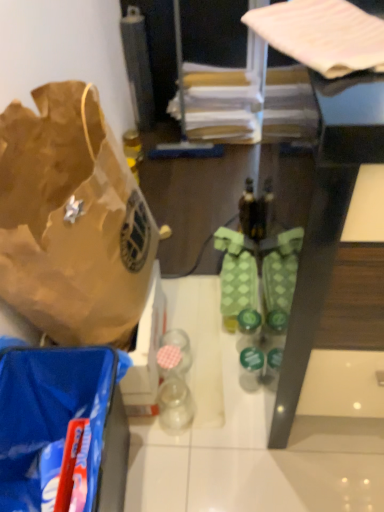
Describe the element at coordinates (72, 220) in the screenshot. I see `brown paper bag at left` at that location.

The width and height of the screenshot is (384, 512). Find the location of `blue plastic bag at lower left`. blue plastic bag at lower left is located at coordinates [x=61, y=420].

In order to face pink fabric at upper right, which is counted as the first wrapping paper, starting from the bottom, should I rotate leftwards or rightwards?

You should look right and rotate roughly 18.516 degrees.

How much space does matte brown wrapping paper at upper center, marked as the 2th wrapping paper in a bottom-to-top arrangement, occupy horizontally?

The width of matte brown wrapping paper at upper center, marked as the 2th wrapping paper in a bottom-to-top arrangement, is 11.35 inches.

This screenshot has height=512, width=384. In order to click on brown paper bag at left in this screenshot , I will do `click(72, 220)`.

Looking at this image, is pink fabric at upper right, arranged as the 2th wrapping paper when viewed from the back, not inside brown paper bag at left?

pink fabric at upper right, arranged as the 2th wrapping paper when viewed from the back, is positioned outside brown paper bag at left.

From a real-world perspective, which object rests below the other?

In real-world perspective, brown paper bag at left is lower.

In order to click on wrapping paper that is above the brown paper bag at left (from a real-world perspective) in this screenshot , I will do `click(322, 35)`.

Can we say matte brown wrapping paper at upper center, which is the 1th wrapping paper in top-to-bottom order, lies outside green matte bottle at center?

Yes.

Can you confirm if matte brown wrapping paper at upper center, marked as the 2th wrapping paper in a bottom-to-top arrangement, is bigger than green matte bottle at center?

Yes, matte brown wrapping paper at upper center, marked as the 2th wrapping paper in a bottom-to-top arrangement, is bigger than green matte bottle at center.

Where is `bottle that is on the right side of matte brown wrapping paper at upper center, the second wrapping paper in the front-to-back sequence`? bottle that is on the right side of matte brown wrapping paper at upper center, the second wrapping paper in the front-to-back sequence is located at coordinates (248, 211).

Can you confirm if matte brown wrapping paper at upper center, which is the 1th wrapping paper in top-to-bottom order, is positioned to the right of green matte bottle at center?

Incorrect, matte brown wrapping paper at upper center, which is the 1th wrapping paper in top-to-bottom order, is not on the right side of green matte bottle at center.

Considering the positions of point (239, 213) and point (147, 285), is point (239, 213) closer or farther from the camera than point (147, 285)?

Point (239, 213).

Considering the positions of objects green matte bottle at center and brown paper bag at left in the image provided, who is more to the left, green matte bottle at center or brown paper bag at left?

brown paper bag at left is more to the left.

Is there a large distance between green matte bottle at center and brown paper bag at left?

Actually, green matte bottle at center and brown paper bag at left are a little close together.

Could you tell me if brown paper bag at left is facing blue plastic bag at lower left?

No, brown paper bag at left is not aimed at blue plastic bag at lower left.

The width and height of the screenshot is (384, 512). I want to click on handbag that is above the blue plastic bag at lower left (from the image's perspective), so click(x=72, y=220).

Looking at this image, considering the positions of objects brown paper bag at left and blue plastic bag at lower left in the image provided, who is more to the right, brown paper bag at left or blue plastic bag at lower left?

blue plastic bag at lower left.

Based on the photo, how many degrees apart are the facing directions of pink fabric at upper right, which is counted as the first wrapping paper, starting from the bottom, and green matte bottle at center?

They differ by 24.8 degrees in their facing directions.

Would you say pink fabric at upper right, arranged as the 2th wrapping paper when viewed from the back, is outside green matte bottle at center?

pink fabric at upper right, arranged as the 2th wrapping paper when viewed from the back, lies outside green matte bottle at center's area.

From the picture: Is pink fabric at upper right, placed as the second wrapping paper when sorted from top to bottom, turned away from green matte bottle at center?

That's not correct — pink fabric at upper right, placed as the second wrapping paper when sorted from top to bottom, is not looking away from green matte bottle at center.

Where is `wrapping paper that is the 1st object to the left of the green matte bottle at center, starting at the anchor`? wrapping paper that is the 1st object to the left of the green matte bottle at center, starting at the anchor is located at coordinates (322, 35).

Who is bigger, brown paper bag at left or green matte bottle at center?

Bigger between the two is brown paper bag at left.

Can we say brown paper bag at left lies outside green matte bottle at center?

Yes.

Is brown paper bag at left with green matte bottle at center?

There is a gap between brown paper bag at left and green matte bottle at center.

Can you tell me how much brown paper bag at left and green matte bottle at center differ in facing direction?

The angle between the facing direction of brown paper bag at left and the facing direction of green matte bottle at center is 0.00232 degrees.

In terms of size, does brown paper bag at left appear bigger or smaller than pink fabric at upper right, arranged as the 2th wrapping paper when viewed from the back?

brown paper bag at left is bigger than pink fabric at upper right, arranged as the 2th wrapping paper when viewed from the back.

Identify the location of handbag located underneath the pink fabric at upper right, which is counted as the first wrapping paper, starting from the bottom (from a real-world perspective). The height and width of the screenshot is (512, 384). pos(72,220).

Which is behind, point (143, 245) or point (264, 36)?

Point (143, 245)

Is brown paper bag at left placed right next to pink fabric at upper right, the 1th wrapping paper in the front-to-back sequence?

No, brown paper bag at left is not in contact with pink fabric at upper right, the 1th wrapping paper in the front-to-back sequence.

In order to click on wrapping paper that is the 2nd object to the right of the brown paper bag at left, starting at the anchor in this screenshot , I will do `click(322, 35)`.

From the green matte bottle at center, count the 2nd wrapping paper to the left and point to it. Please provide its 2D coordinates.

[(220, 105)]

Estimate the real-world distances between objects in this image. Which object is closer to green matte bottle at center, blue plastic bag at lower left or brown paper bag at left?

brown paper bag at left.

Considering their positions, is matte brown wrapping paper at upper center, which is counted as the 1th wrapping paper, starting from the back, positioned further to green matte bottle at center than brown paper bag at left?

Based on the image, brown paper bag at left appears to be further to green matte bottle at center.

Which object lies nearer to the anchor point green matte bottle at center, matte brown wrapping paper at upper center, which is the 1th wrapping paper in top-to-bottom order, or pink fabric at upper right, the 1th wrapping paper in the front-to-back sequence?

The object closer to green matte bottle at center is matte brown wrapping paper at upper center, which is the 1th wrapping paper in top-to-bottom order.

Considering their positions, is matte brown wrapping paper at upper center, which is counted as the 1th wrapping paper, starting from the back, positioned closer to pink fabric at upper right, which is counted as the first wrapping paper, starting from the bottom, than brown paper bag at left?

The object closer to pink fabric at upper right, which is counted as the first wrapping paper, starting from the bottom, is brown paper bag at left.

Considering their positions, is blue plastic bag at lower left positioned closer to green matte bottle at center than pink fabric at upper right, the 1th wrapping paper in the front-to-back sequence?

blue plastic bag at lower left lies closer to green matte bottle at center than the other object.

Looking at the image, which one is located closer to matte brown wrapping paper at upper center, which is the 1th wrapping paper in top-to-bottom order, pink fabric at upper right, which is counted as the first wrapping paper, starting from the bottom, or green matte bottle at center?

green matte bottle at center.

Consider the image. Estimate the real-world distances between objects in this image. Which object is further from brown paper bag at left, matte brown wrapping paper at upper center, which is counted as the 1th wrapping paper, starting from the back, or green matte bottle at center?

matte brown wrapping paper at upper center, which is counted as the 1th wrapping paper, starting from the back, lies further to brown paper bag at left than the other object.

Considering their positions, is pink fabric at upper right, which is counted as the first wrapping paper, starting from the bottom, positioned further to matte brown wrapping paper at upper center, the second wrapping paper in the front-to-back sequence, than blue plastic bag at lower left?

blue plastic bag at lower left lies further to matte brown wrapping paper at upper center, the second wrapping paper in the front-to-back sequence, than the other object.

Identify the location of handbag between pink fabric at upper right, the 1th wrapping paper in the front-to-back sequence, and blue plastic bag at lower left vertically. (72, 220).

This screenshot has height=512, width=384. Identify the location of bottle located between pink fabric at upper right, placed as the second wrapping paper when sorted from top to bottom, and matte brown wrapping paper at upper center, the second wrapping paper in the front-to-back sequence, in the depth direction. (248, 211).

This screenshot has width=384, height=512. What are the coordinates of `bottle between blue plastic bag at lower left and matte brown wrapping paper at upper center, which is the 1th wrapping paper in top-to-bottom order, in the front-back direction` in the screenshot? It's located at (248, 211).

Identify the location of handbag between pink fabric at upper right, which is counted as the first wrapping paper, starting from the bottom, and green matte bottle at center in the front-back direction. The height and width of the screenshot is (512, 384). (72, 220).